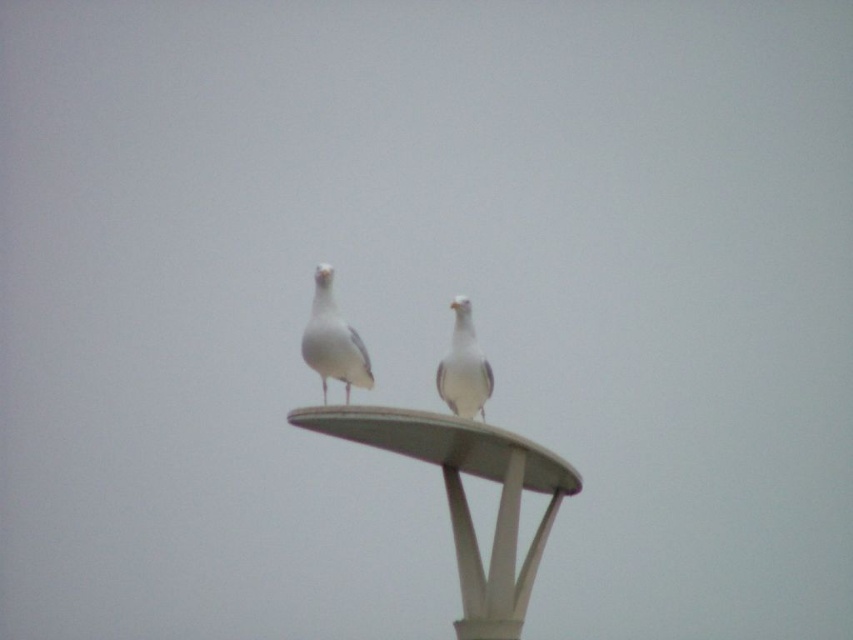
You are a photographer trying to capture a photo of the white feathered bird at center. You need to know the position of the white matte lamp post at center relative to the bird to frame the shot. Is the lamp post to the left or right of the bird?

The white matte lamp post at center is positioned on the left side of white feathered bird at center.